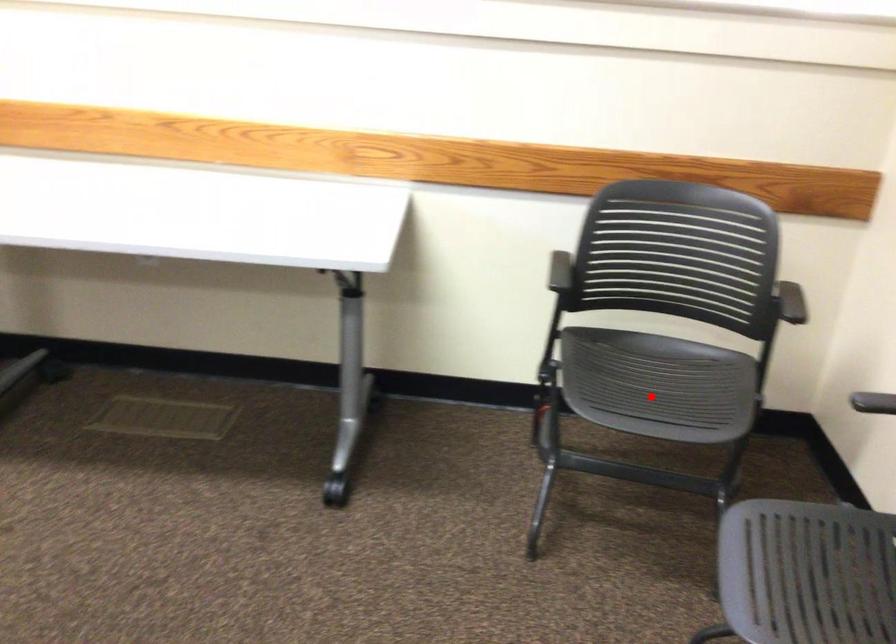
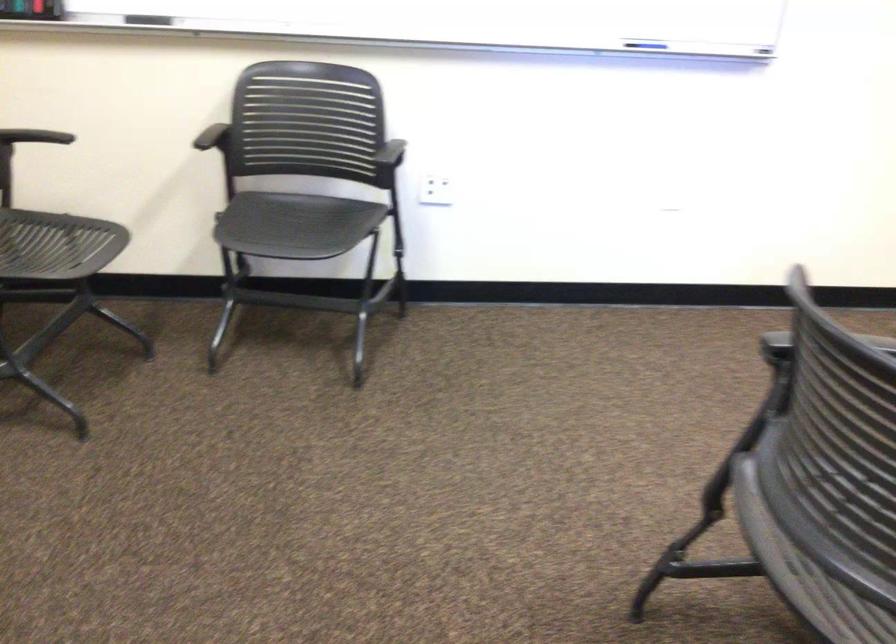
Question: I am providing you with two images of the same scene from different viewpoints. A red point is shown in image1. For the corresponding object point in image2, is it positioned nearer or farther from the camera?

Choices:
 (A) Nearer
 (B) Farther

Answer: (B)